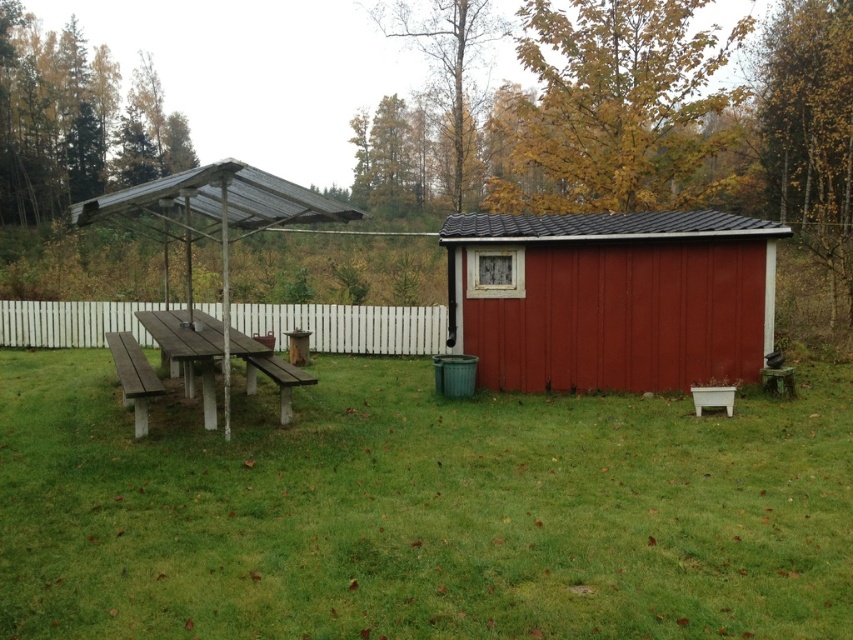
Is point (614, 365) closer to camera compared to point (438, 314)?

Yes, it is in front of point (438, 314).

Is point (624, 340) farther from viewer compared to point (322, 330)?

No, it is not.

Find the location of a particular element. Image resolution: width=853 pixels, height=640 pixels. matte red shed at center right is located at coordinates (610, 298).

Measure the distance from green grass at center to white wooden fence at center.

green grass at center and white wooden fence at center are 28.30 feet apart.

Does green grass at center have a greater height compared to white wooden fence at center?

Yes.

Describe the element at coordinates (421, 509) in the screenshot. I see `green grass at center` at that location.

Identify the location of green grass at center. The height and width of the screenshot is (640, 853). (421, 509).

Is point (254, 304) closer to camera compared to point (204, 348)?

No, it is not.

Between white wooden fence at center and wooden picnic table at left, which one appears on the left side from the viewer's perspective?

Positioned to the left is white wooden fence at center.

Find the location of a particular element. Image resolution: width=853 pixels, height=640 pixels. white wooden fence at center is located at coordinates (347, 326).